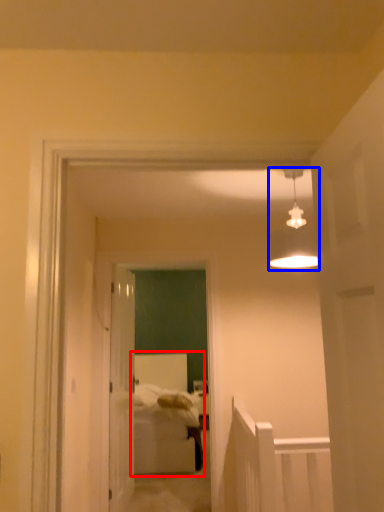
Question: Among these objects, which one is nearest to the camera, bed (highlighted by a red box) or light fixture (highlighted by a blue box)?

Choices:
 (A) bed
 (B) light fixture

Answer: (B)